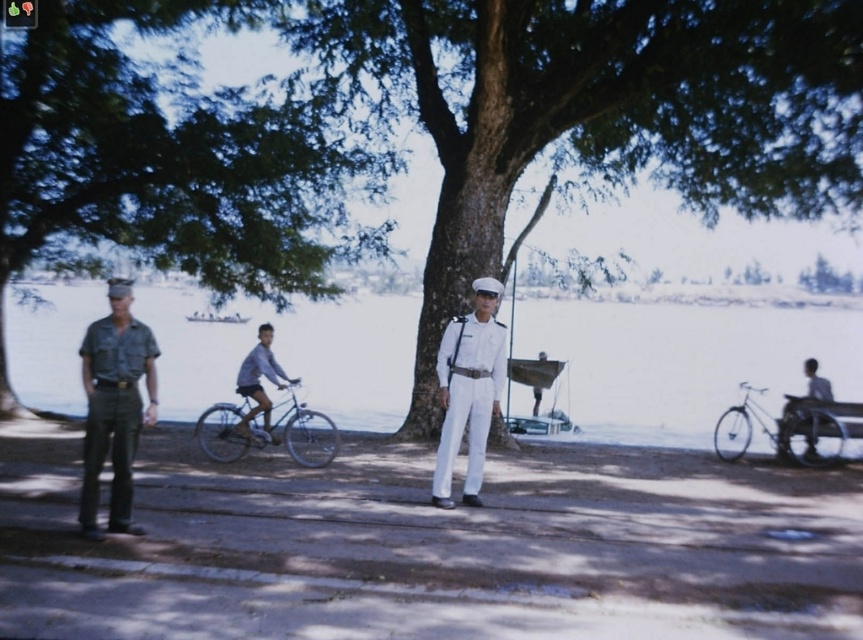
Question: Can you confirm if green leafy tree at center is positioned below light blue fabric shirt at center?

Choices:
 (A) no
 (B) yes

Answer: (A)

Question: In this image, where is camouflage fabric shirt at left located relative to wooden park bench at right?

Choices:
 (A) left
 (B) right

Answer: (A)

Question: Is white matte uniform at center below light blue fabric shirt at center?

Choices:
 (A) no
 (B) yes

Answer: (B)

Question: Among these objects, which one is nearest to the camera?

Choices:
 (A) camouflage fabric shirt at left
 (B) wooden park bench at right

Answer: (A)

Question: Among these points, which one is nearest to the camera?

Choices:
 (A) (784, 394)
 (B) (690, 189)
 (C) (149, 253)
 (D) (127, 435)

Answer: (D)

Question: Which object is closer to the camera taking this photo?

Choices:
 (A) silver metallic bicycle at right
 (B) green leafy tree at upper left

Answer: (A)